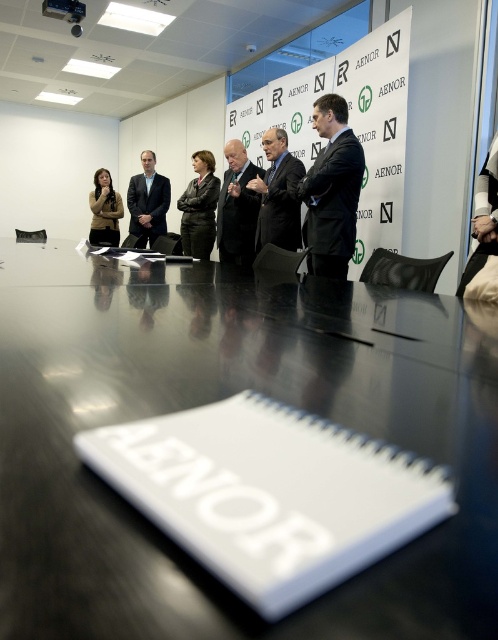
In the scene shown: You are attending a meeting in a conference room and notice the black glossy table at center and the dark gray suit at center. From your perspective, which object is positioned lower in the scene?

The black glossy table at center is located below dark gray suit at center, so the black glossy table at center is positioned lower in the scene.